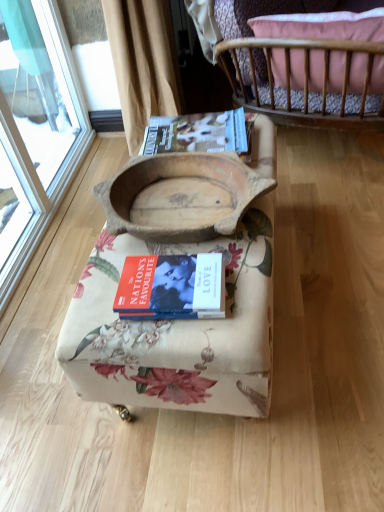
Identify the location of vacant space to the right of hardcover book at center. The image size is (384, 512). (246, 275).